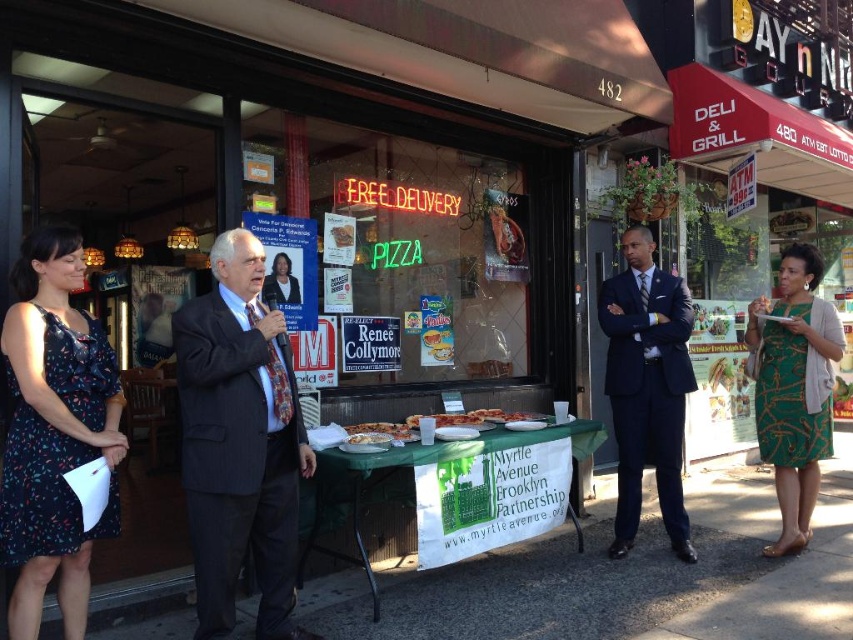
You are a photographer at the event who needs to capture both the pinstriped suit at center and the matte black suit at center in a single photo. Which suit should you position closer to the camera to ensure both are fully visible?

The pinstriped suit at center is much taller than the matte black suit at center, so positioning the pinstriped suit at center closer to the camera will help ensure both are fully visible in the photo.

You are a photographer standing behind the table covered with a green tablecloth. You want to take a photo of the dark floral dress at left and the navy blue suit at center so that both are in the frame. Given that your camera has a maximum focus range of 9 feet, will both subjects be within the focus range?

The dark floral dress at left and navy blue suit at center are 9.06 feet apart. Since the camera can focus up to 9 feet, the distance between them slightly exceeds the maximum focus range. Therefore, both subjects may not be in focus simultaneously.

You are standing at the entrance of the deli and grill store. You see two points marked on the ground in front of you. The first point is at coordinate point(x=271, y=444) and the second is at point(x=282, y=284). If you want to move from the entrance towards the first point, will you pass by the second point on your way?

Point(x=271, y=444) is in front of point(x=282, y=284). So, if you move from the entrance towards the first point, you will pass by the second point on your way.